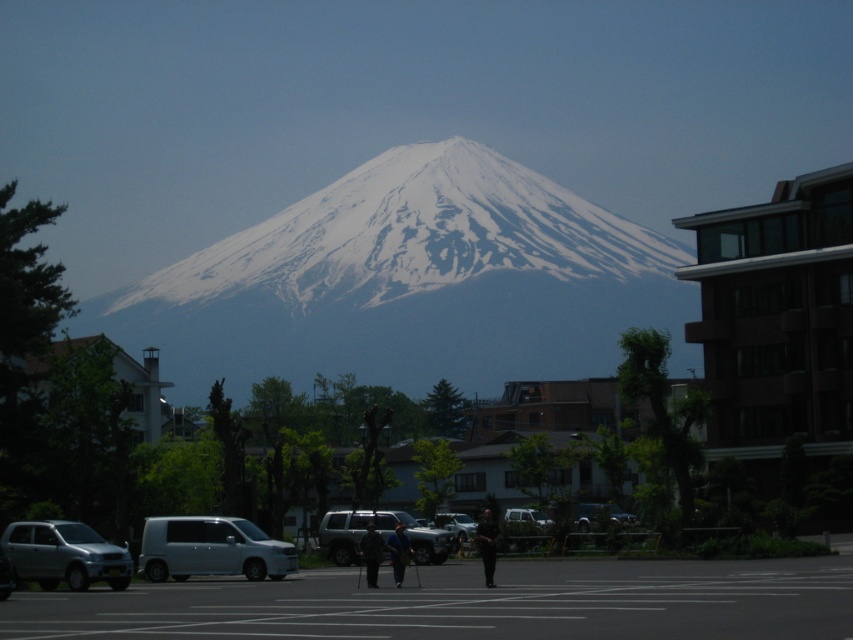
Question: Which point is closer to the camera taking this photo?

Choices:
 (A) (187, 566)
 (B) (395, 586)
 (C) (436, 525)
 (D) (490, 552)

Answer: (D)

Question: Can you confirm if white matte van at center is thinner than dark blue jeans at center?

Choices:
 (A) yes
 (B) no

Answer: (A)

Question: Which point is farther to the camera?

Choices:
 (A) white snow-covered mountain at center
 (B) dark gray fabric pants at center
 (C) silver metallic van at lower left

Answer: (A)

Question: Can you confirm if dark blue shirt at center is positioned above dark gray fabric pants at center?

Choices:
 (A) no
 (B) yes

Answer: (A)

Question: Considering the relative positions of white snow-covered mountain at center and metallic silver car at center in the image provided, where is white snow-covered mountain at center located with respect to metallic silver car at center?

Choices:
 (A) above
 (B) below

Answer: (A)

Question: Which object is positioned closest to the dark blue shirt at center?

Choices:
 (A) silver metallic suv at center
 (B) white matte van at center

Answer: (A)